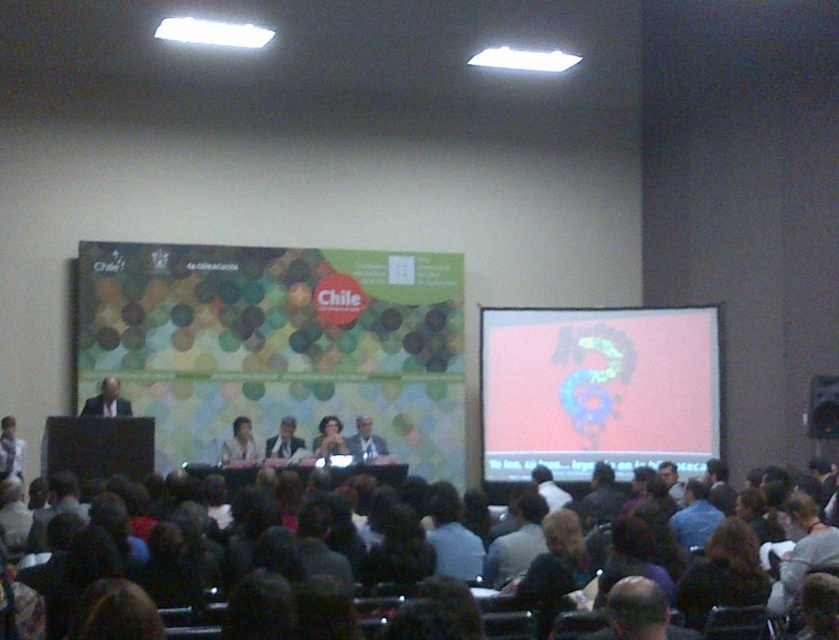
You are an event organizer who needs to ensure that the pink matte projection screen at upper right and the dark brown hair at lower right are visible to all attendees. Based on their heights, which object might require adjustment to ensure visibility?

The dark brown hair at lower right might require adjustment since it is shorter than the pink matte projection screen at upper right, which is taller and likely already visible.

You are a photographer at the conference and want to capture a clear shot of the light brown hair at center and the matte black suit at left. Since you can only focus on one subject, which one will naturally be in focus if you aim at the other?

The light brown hair at center is positioned under matte black suit at left, so if you focus on the matte black suit at left, the light brown hair at center will also be in focus because they are at the same distance from the camera.

You are an event photographer trying to capture a photo of the speaker at the podium. You notice the pink matte projection screen at upper right and the dark brown hair at lower right in your camera frame. Which object should you adjust your focus to avoid blurring? Explain your reasoning.

The pink matte projection screen at upper right has a larger size compared to the dark brown hair at lower right, so it is more likely to dominate the frame and require focus adjustment to ensure clarity. The dark brown hair at lower right is smaller and might be less critical for the composition, but you should still ensure overall focus based on your intended subject.